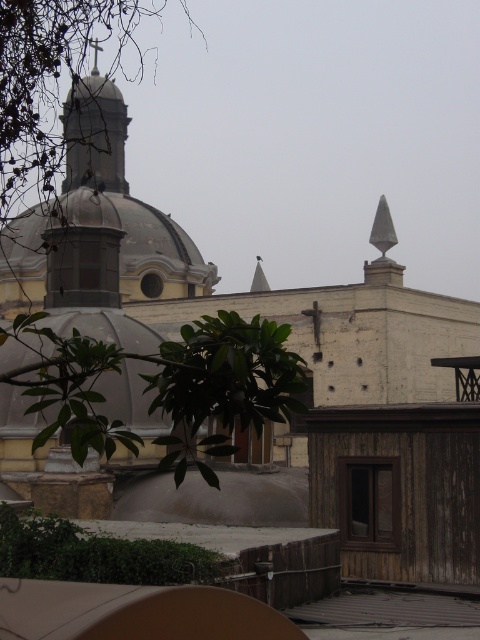
You are standing in front of the historic building and notice the gray stone dome at upper left and the green leafy tree at center. Which object is positioned higher in the scene?

The gray stone dome at upper left is positioned higher than the green leafy tree at center.

You are standing in front of the historic building and want to determine the distance between two points on the structure. The first point is at coordinates point (131, 225) and the second point is at point (235, 348). Which point is closer to you?

Point (131, 225) is closer to you because it is further to the viewer than point (235, 348).

You are standing in front of the central dome and want to locate the gray stone dome at upper left. Based on the coordinates provided, in which direction should you turn your head to see it?

The gray stone dome at upper left is located at coordinates 0.311 on the x axis and 0.269 on the y axis. Since the coordinates are in the upper left quadrant, you should turn your head to the left and upwards to see it.